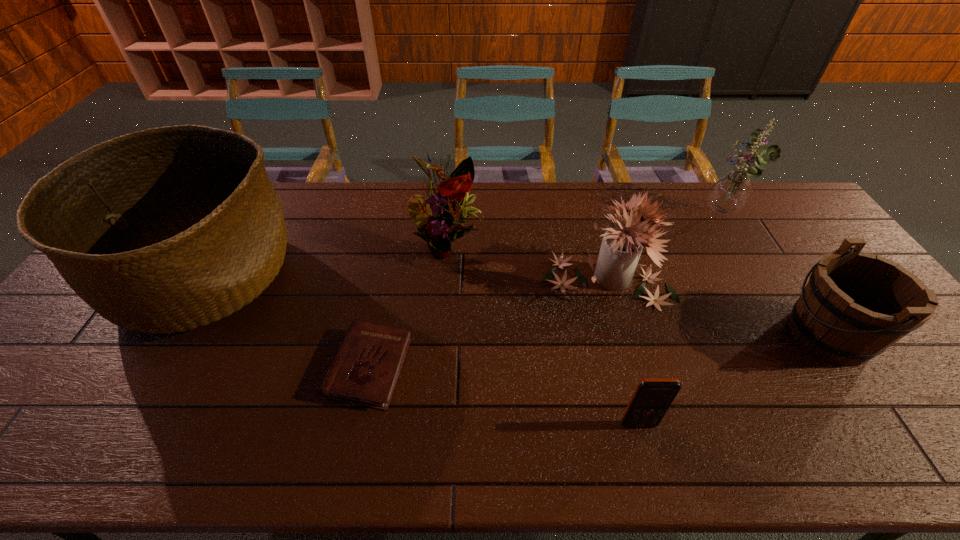
Identify the location of the leftmost object. point(171,228).

Where is `the rightmost bouquet`? This screenshot has width=960, height=540. the rightmost bouquet is located at coordinates tap(730, 192).

At what (x,y) coordinates should I click in order to perform the action: click on the leftmost bouquet. Please return your answer as a coordinate pair (x, y). This screenshot has height=540, width=960. Looking at the image, I should click on (438, 217).

Locate an element on the screen. The image size is (960, 540). the second bouquet from left to right is located at coordinates (621, 247).

Locate an element on the screen. the third shortest object is located at coordinates (855, 305).

Identify the location of cellular telephone. This screenshot has height=540, width=960. (652, 398).

Identify the location of the sixth tallest object. The height and width of the screenshot is (540, 960). (652, 398).

Locate an element on the screen. Image resolution: width=960 pixels, height=540 pixels. the shortest object is located at coordinates (366, 367).

Image resolution: width=960 pixels, height=540 pixels. I want to click on vacant space located on the back of the leftmost object, so click(x=252, y=195).

Find the location of a particular element. The image size is (960, 540). free space located on the front-facing side of the rightmost bouquet is located at coordinates (648, 215).